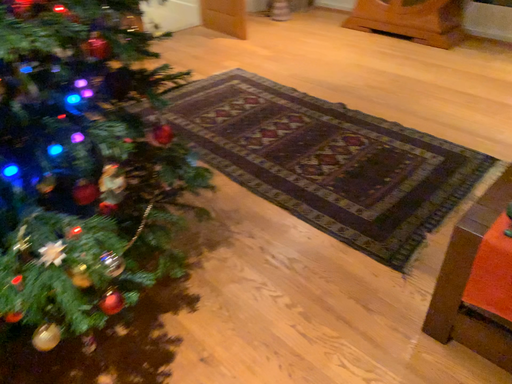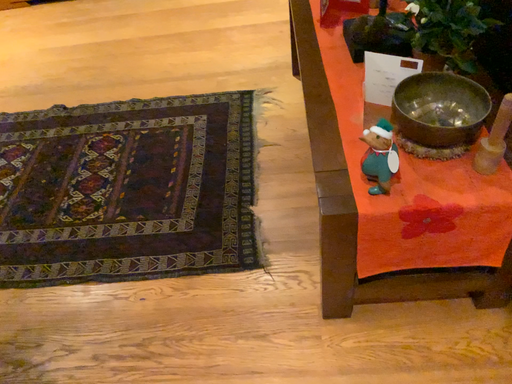
Question: Which way did the camera rotate in the video?

Choices:
 (A) rotated left
 (B) rotated right

Answer: (B)